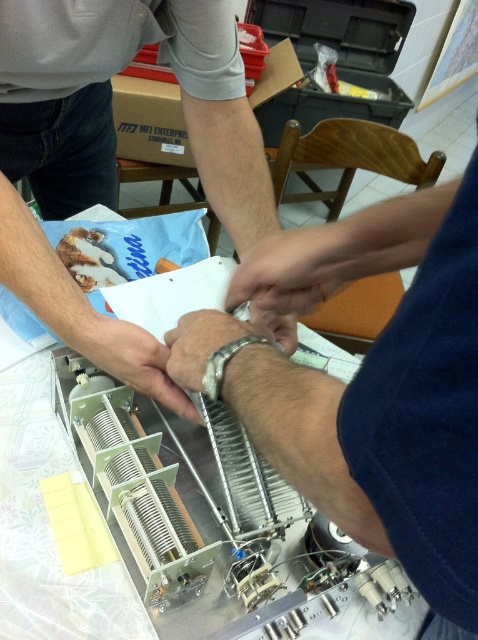
Is metallic silver wristwatch at center positioned in front of silver metallic bracelet at center?

That is True.

Can you confirm if metallic silver wristwatch at center is taller than silver metallic bracelet at center?

Yes.

Which is in front, point (308, 253) or point (258, 378)?

Point (258, 378) is more forward.

Find the location of `metallic silver wristwatch at center`. metallic silver wristwatch at center is located at coordinates (369, 385).

Which is more to the right, white matte hand at center or silver metallic bracelet at center?

white matte hand at center is more to the right.

Can you confirm if white matte hand at center is positioned above silver metallic bracelet at center?

Correct, white matte hand at center is located above silver metallic bracelet at center.

Does point (354, 236) come closer to viewer compared to point (223, 384)?

No, it is not.

Locate an element on the screen. white matte hand at center is located at coordinates (295, 269).

Does white matte hand at center come in front of sleek silver wristwatch at center?

Yes, it is.

Who is positioned more to the right, white matte hand at center or sleek silver wristwatch at center?

From the viewer's perspective, white matte hand at center appears more on the right side.

I want to click on white matte hand at center, so click(x=295, y=269).